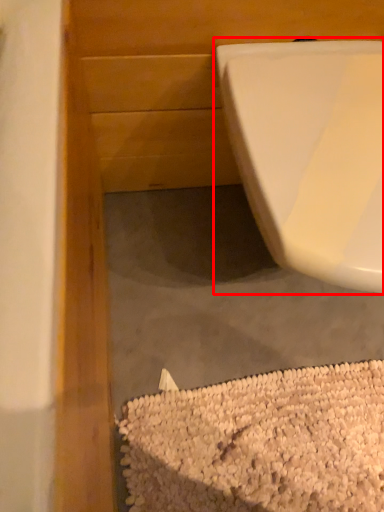
Question: In this image, where is toilet (annotated by the red box) located relative to debris?

Choices:
 (A) right
 (B) left

Answer: (A)